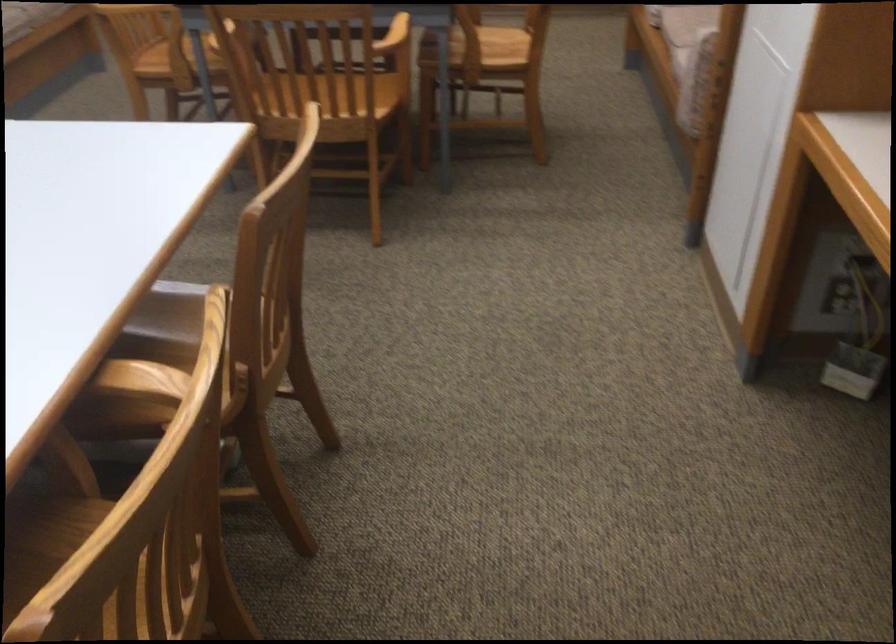
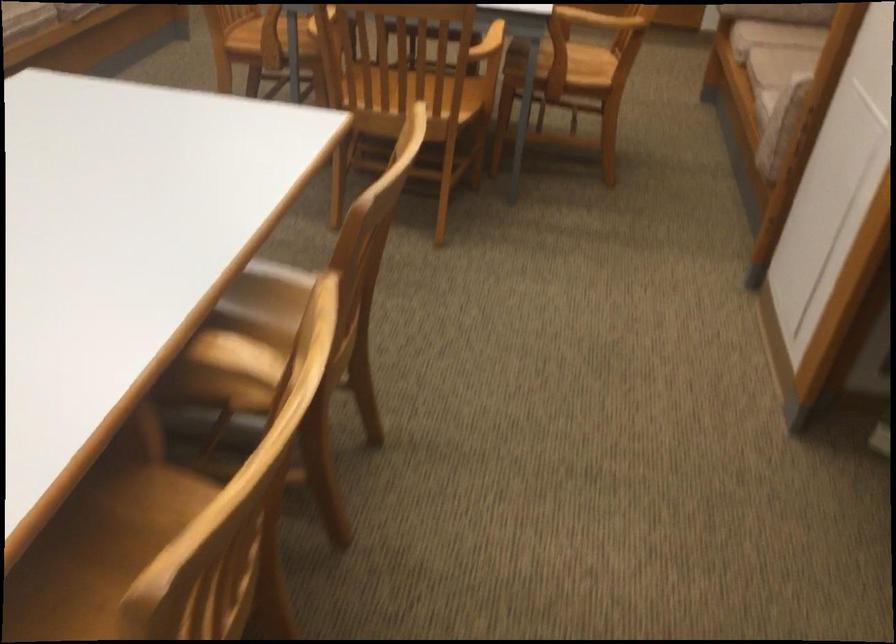
The point at (311,102) is marked in the first image. Where is the corresponding point in the second image?

(419, 104)